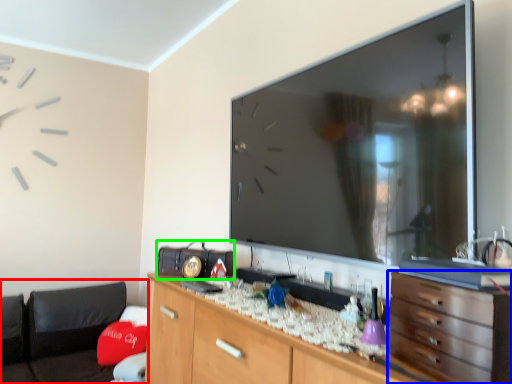
Question: Considering the real-world distances, which object is farthest from bean bag chair (highlighted by a red box)? chest of drawers (highlighted by a blue box) or radio (highlighted by a green box)?

Choices:
 (A) chest of drawers
 (B) radio

Answer: (A)